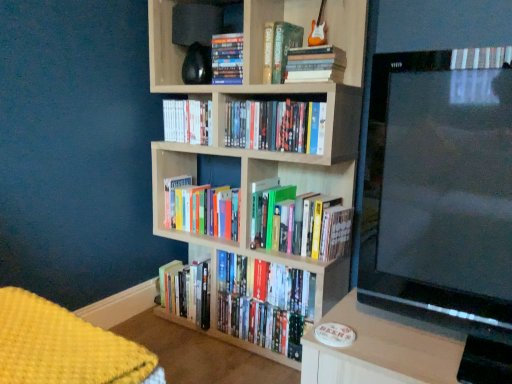
Question: Which direction should I rotate to look at hardcover book at center, the 8th book positioned from the bottom, — up or down?

Choices:
 (A) up
 (B) down

Answer: (A)

Question: Considering the relative sizes of hardcover books at center, placed as the first book when sorted from bottom to top, and hardcover books at upper center, the seventh book from the bottom, in the image provided, is hardcover books at center, placed as the first book when sorted from bottom to top, thinner than hardcover books at upper center, the seventh book from the bottom,?

Choices:
 (A) yes
 (B) no

Answer: (B)

Question: Is hardcover books at center, placed as the first book when sorted from bottom to top, in contact with hardcover books at upper center, which is the 2th book from top to bottom?

Choices:
 (A) no
 (B) yes

Answer: (A)

Question: Is hardcover books at center, which is the eighth book in top-to-bottom order, far from hardcover books at upper center, the seventh book from the bottom?

Choices:
 (A) no
 (B) yes

Answer: (A)

Question: Considering the relative sizes of hardcover books at center, which is the eighth book in top-to-bottom order, and hardcover books at upper center, the seventh book from the bottom, in the image provided, is hardcover books at center, which is the eighth book in top-to-bottom order, bigger than hardcover books at upper center, the seventh book from the bottom,?

Choices:
 (A) yes
 (B) no

Answer: (A)

Question: From the image's perspective, is hardcover books at center, placed as the first book when sorted from bottom to top, under hardcover books at upper center, which is the 2th book from top to bottom?

Choices:
 (A) no
 (B) yes

Answer: (B)

Question: Is hardcover books at upper center, the seventh book from the bottom, located within hardcover books at center, which is the eighth book in top-to-bottom order?

Choices:
 (A) no
 (B) yes

Answer: (A)

Question: From a real-world perspective, does hardcover book at center, which is counted as the 1th book, starting from the top, stand above yellow knitted blanket at lower left?

Choices:
 (A) yes
 (B) no

Answer: (A)

Question: Is hardcover book at center, which is counted as the 1th book, starting from the top, far from yellow knitted blanket at lower left?

Choices:
 (A) yes
 (B) no

Answer: (A)

Question: Does hardcover book at center, the 8th book positioned from the bottom, have a larger size compared to yellow knitted blanket at lower left?

Choices:
 (A) no
 (B) yes

Answer: (A)

Question: Could you tell me if hardcover book at center, which is counted as the 1th book, starting from the top, is facing yellow knitted blanket at lower left?

Choices:
 (A) yes
 (B) no

Answer: (B)

Question: Is hardcover book at center, which is counted as the 1th book, starting from the top, outside of yellow knitted blanket at lower left?

Choices:
 (A) no
 (B) yes

Answer: (B)

Question: Is hardcover book at center, which is counted as the 1th book, starting from the top, facing away from yellow knitted blanket at lower left?

Choices:
 (A) no
 (B) yes

Answer: (A)

Question: From the image's perspective, is yellow knitted blanket at lower left located beneath black glossy tv at right?

Choices:
 (A) yes
 (B) no

Answer: (A)